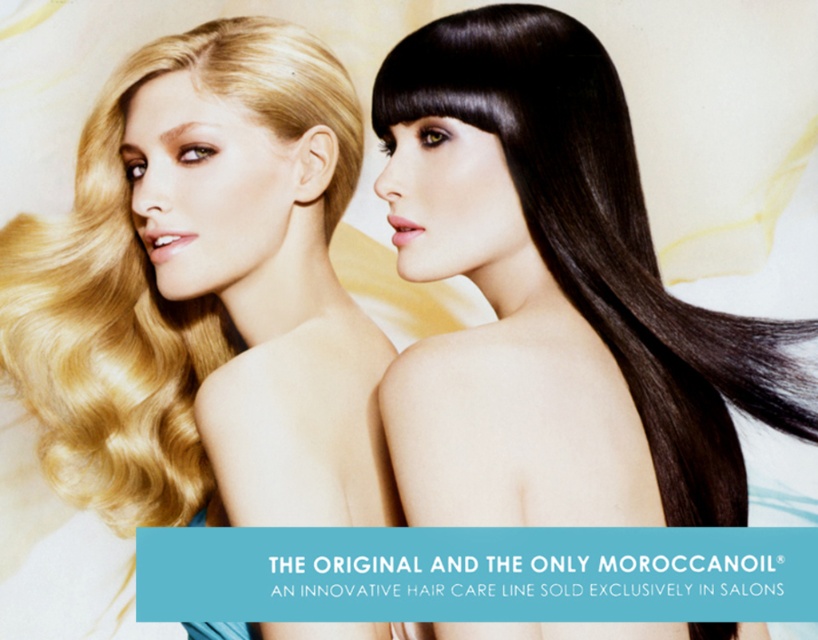
Question: Is shiny dark brown hair at center closer to the viewer compared to shiny blonde hair at left?

Choices:
 (A) no
 (B) yes

Answer: (B)

Question: Which point appears closest to the camera in this image?

Choices:
 (A) (663, 442)
 (B) (144, 369)

Answer: (A)

Question: Can you confirm if shiny dark brown hair at center is bigger than shiny blonde hair at left?

Choices:
 (A) yes
 (B) no

Answer: (A)

Question: Does shiny dark brown hair at center have a smaller size compared to shiny blonde hair at left?

Choices:
 (A) yes
 (B) no

Answer: (B)